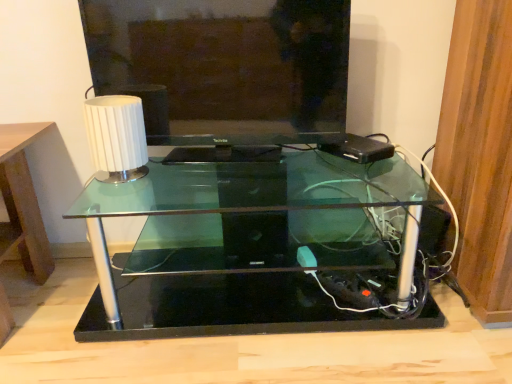
Identify the location of matte black television at center. (228, 65).

Is matte black television at center to the left of white ribbed lampshade at upper left from the viewer's perspective?

Incorrect, matte black television at center is not on the left side of white ribbed lampshade at upper left.

This screenshot has width=512, height=384. I want to click on table lamp that appears below the matte black television at center (from a real-world perspective), so click(117, 137).

How many degrees apart are the facing directions of matte black television at center and white ribbed lampshade at upper left?

4.01 degrees separate the facing orientations of matte black television at center and white ribbed lampshade at upper left.

Considering the relative sizes of matte black television at center and white ribbed lampshade at upper left in the image provided, is matte black television at center taller than white ribbed lampshade at upper left?

Correct, matte black television at center is much taller as white ribbed lampshade at upper left.

Does transparent glass table at center have a smaller size compared to white ribbed lampshade at upper left?

Actually, transparent glass table at center might be larger than white ribbed lampshade at upper left.

Which object is thinner, transparent glass table at center or white ribbed lampshade at upper left?

white ribbed lampshade at upper left is thinner.

Is transparent glass table at center positioned with its back to white ribbed lampshade at upper left?

No, transparent glass table at center is not facing away from white ribbed lampshade at upper left.

Between transparent glass table at center and white ribbed lampshade at upper left, which one is positioned in front?

transparent glass table at center is more forward.

Find the location of a particular element. The image size is (512, 384). table directly beneath the matte black television at center (from a real-world perspective) is located at coordinates (249, 246).

Consider the image. Considering the sizes of objects matte black television at center and transparent glass table at center in the image provided, who is bigger, matte black television at center or transparent glass table at center?

transparent glass table at center is bigger.

Is matte black television at center located outside transparent glass table at center?

That's correct, matte black television at center is outside of transparent glass table at center.

Is point (342, 3) positioned behind point (298, 308)?

No.

From the image's perspective, is white ribbed lampshade at upper left located beneath transparent glass table at center?

Actually, white ribbed lampshade at upper left appears above transparent glass table at center in the image.

Considering the positions of objects white ribbed lampshade at upper left and transparent glass table at center in the image provided, who is more to the left, white ribbed lampshade at upper left or transparent glass table at center?

white ribbed lampshade at upper left.

Which of these two, white ribbed lampshade at upper left or transparent glass table at center, is smaller?

white ribbed lampshade at upper left is smaller.

Is white ribbed lampshade at upper left not inside transparent glass table at center?

Indeed, white ribbed lampshade at upper left is completely outside transparent glass table at center.

Is white ribbed lampshade at upper left oriented away from matte black television at center?

Correct, white ribbed lampshade at upper left is looking away from matte black television at center.

From the image's perspective, is white ribbed lampshade at upper left beneath matte black television at center?

Yes, from the image's perspective, white ribbed lampshade at upper left is beneath matte black television at center.

Looking at the image, does transparent glass table at center seem bigger or smaller compared to matte black television at center?

transparent glass table at center is bigger than matte black television at center.

Looking at this image, in terms of height, does transparent glass table at center look taller or shorter compared to matte black television at center?

Clearly, transparent glass table at center is shorter compared to matte black television at center.

Between transparent glass table at center and matte black television at center, which one has smaller width?

matte black television at center is thinner.

From the image's perspective, is transparent glass table at center located above matte black television at center?

No, from the image's perspective, transparent glass table at center is not above matte black television at center.

Locate an element on the screen. table lamp on the left of matte black television at center is located at coordinates (117, 137).

The image size is (512, 384). In the image, there is a white ribbed lampshade at upper left. Find the location of `table below it (from the image's perspective)`. table below it (from the image's perspective) is located at coordinates (249, 246).

Which object lies nearer to the anchor point matte black television at center, transparent glass table at center or white ribbed lampshade at upper left?

The object closer to matte black television at center is white ribbed lampshade at upper left.

When comparing their distances from white ribbed lampshade at upper left, does matte black television at center or transparent glass table at center seem closer?

matte black television at center is positioned closer to the anchor white ribbed lampshade at upper left.

Looking at the image, which one is located closer to matte black television at center, white ribbed lampshade at upper left or transparent glass table at center?

Based on the image, white ribbed lampshade at upper left appears to be nearer to matte black television at center.

Considering their positions, is matte black television at center positioned closer to transparent glass table at center than white ribbed lampshade at upper left?

matte black television at center.

Looking at the image, which one is located closer to white ribbed lampshade at upper left, transparent glass table at center or matte black television at center?

Based on the image, matte black television at center appears to be nearer to white ribbed lampshade at upper left.

Considering their positions, is white ribbed lampshade at upper left positioned closer to transparent glass table at center than matte black television at center?

The object closer to transparent glass table at center is matte black television at center.

I want to click on table lamp that lies between matte black television at center and transparent glass table at center from top to bottom, so click(117, 137).